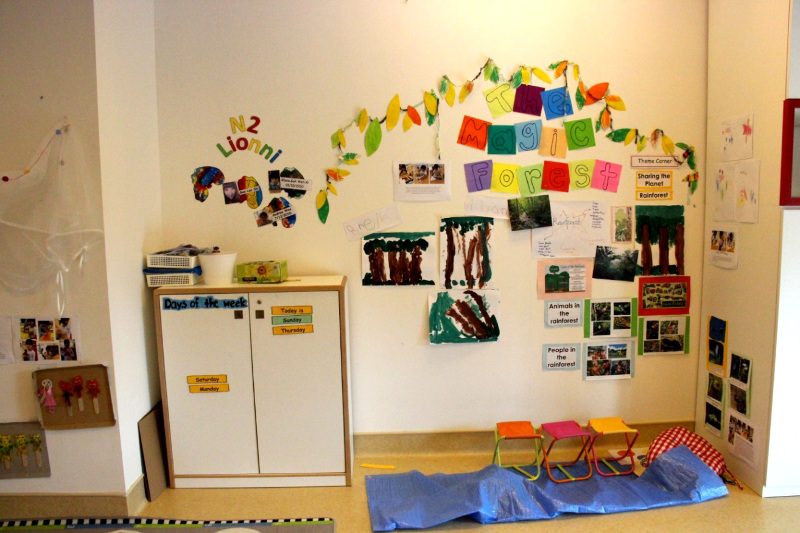
Find the location of a particular element. lock is located at coordinates (224, 129), (222, 204), (253, 301).